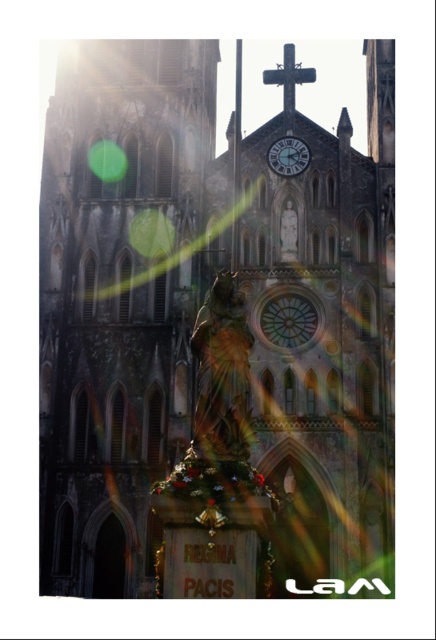
Looking at this image, you are a tour guide explaining the cathedral to visitors. You mention both the gold polished statue at center and the matte black clock at center. Which one is bigger?

The gold polished statue at center is larger than the matte black clock at center.

You are an architect examining the cathedral facade. You notice the gold polished statue at center and the matte black clock at center. Which object is located to the left of the other?

The gold polished statue at center is positioned on the left side of the matte black clock at center.

From the picture: You are standing in front of the cathedral and want to take a photo of both the stone church at center and the matte black clock at center. Which object should you position to your right side to ensure both are in the frame?

You should position the matte black clock at center to your right side because the stone church at center is to the left of the matte black clock at center, so placing the clock on your right will keep both in the frame.